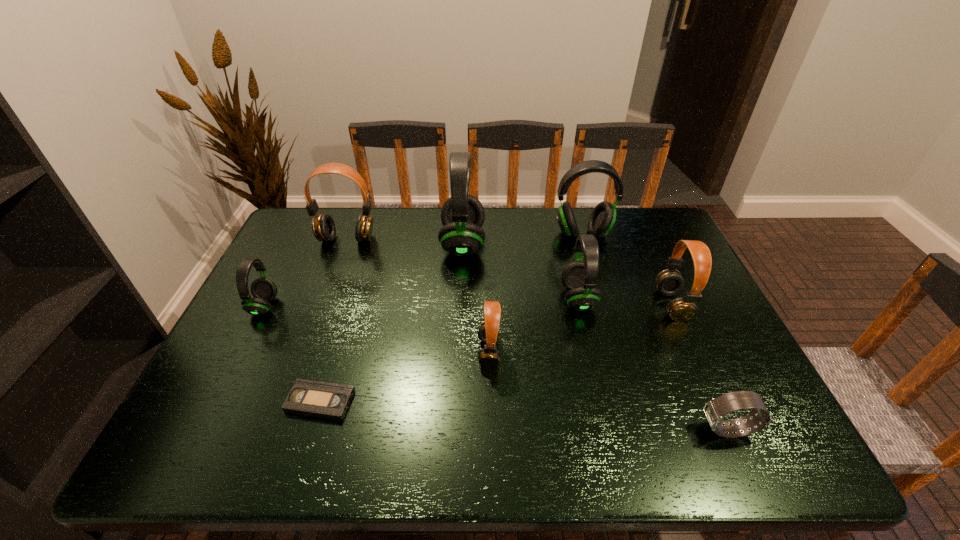
In order to click on the tallest object in this screenshot , I will do `click(462, 215)`.

At what (x,y) coordinates should I click in order to perform the action: click on the tallest headset. Please return your answer as a coordinate pair (x, y). Looking at the image, I should click on (462, 215).

Where is `the third smallest black headset`? The height and width of the screenshot is (540, 960). the third smallest black headset is located at coordinates (602, 219).

The width and height of the screenshot is (960, 540). I want to click on the second headset from left to right, so click(323, 226).

I want to click on the leftmost brown headset, so click(x=323, y=226).

You are a GUI agent. You are given a task and a screenshot of the screen. Output one action in this format:
    pyautogui.click(x=<x>, y=<y>)
    Task: Click on the rightmost headset
    The height and width of the screenshot is (540, 960).
    Given the screenshot: What is the action you would take?
    pyautogui.click(x=669, y=282)

Where is `the second biggest brown headset`? This screenshot has height=540, width=960. the second biggest brown headset is located at coordinates (669, 282).

The height and width of the screenshot is (540, 960). I want to click on the third biggest black headset, so click(x=579, y=278).

Locate an element on the screen. the nearest headset is located at coordinates (488, 332).

Where is `the second brown headset from right to left`? This screenshot has height=540, width=960. the second brown headset from right to left is located at coordinates (488, 332).